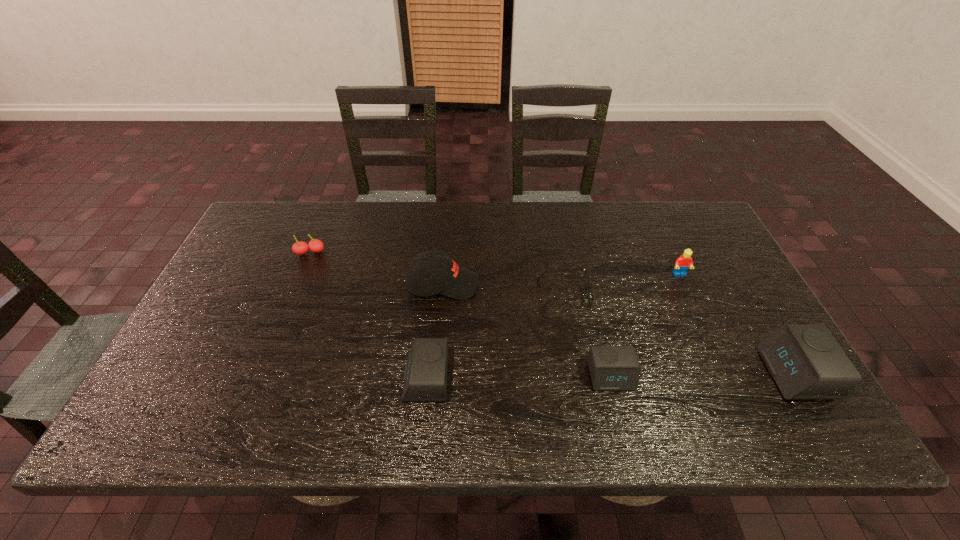
Where is `free space located on the face of the sixth object from left to right`? This screenshot has height=540, width=960. free space located on the face of the sixth object from left to right is located at coordinates (697, 313).

Where is `object that is at the far edge`? object that is at the far edge is located at coordinates (300, 248).

Identify the location of alarm clock that is at the right edge. (805, 360).

At what (x,y) coordinates should I click in order to perform the action: click on Lego that is at the right edge. Please return your answer as a coordinate pair (x, y). This screenshot has width=960, height=540. Looking at the image, I should click on (682, 264).

Where is `object that is at the near right corner`? This screenshot has height=540, width=960. object that is at the near right corner is located at coordinates (805, 360).

Locate an element on the screen. This screenshot has width=960, height=540. vacant area at the far edge of the desktop is located at coordinates (338, 238).

In the image, there is a desktop. At what (x,y) coordinates should I click in order to perform the action: click on vacant space at the near edge. Please return your answer as a coordinate pair (x, y). Image resolution: width=960 pixels, height=540 pixels. Looking at the image, I should click on (682, 395).

What are the coordinates of `free space at the left edge of the desktop` in the screenshot? It's located at (274, 253).

The width and height of the screenshot is (960, 540). In the image, there is a desktop. In order to click on vacant space at the right edge in this screenshot , I will do `click(745, 308)`.

Find the location of a particular element. Image resolution: width=960 pixels, height=540 pixels. free space at the far right corner of the desktop is located at coordinates (669, 225).